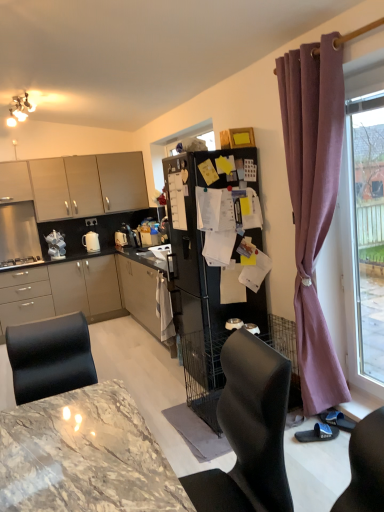
Question: In terms of size, does matte white cabinet at upper left, acting as the 2th cabinetry starting from the bottom, appear bigger or smaller than pink fabric curtain at right?

Choices:
 (A) big
 (B) small

Answer: (B)

Question: Is matte white cabinet at upper left, the second cabinetry from the top, in front of or behind pink fabric curtain at right in the image?

Choices:
 (A) front
 (B) behind

Answer: (B)

Question: Which of these objects is positioned farthest from the pink fabric curtain at right?

Choices:
 (A) matte white cabinet at upper left, the second cabinetry from the top
 (B) matte gray cabinets at left, which is the first cabinetry from bottom to top
 (C) purple fabric curtain at right
 (D) matte beige cabinets at upper left, positioned as the 3th cabinetry in bottom-to-top order
 (E) white glossy electric kettle at center, which is the 1th appliance from right to left

Answer: (A)

Question: Which is nearer to the white glossy kettle at left, which ranks as the 2th appliance in left-to-right order?

Choices:
 (A) matte beige cabinets at upper left, which is the first cabinetry from top to bottom
 (B) brushed metal oven at left, marked as the 3th appliance in a right-to-left arrangement
 (C) pink fabric curtain at right
 (D) black matte refrigerator at center
 (E) white glossy electric kettle at center, which is the third appliance in left-to-right order

Answer: (B)